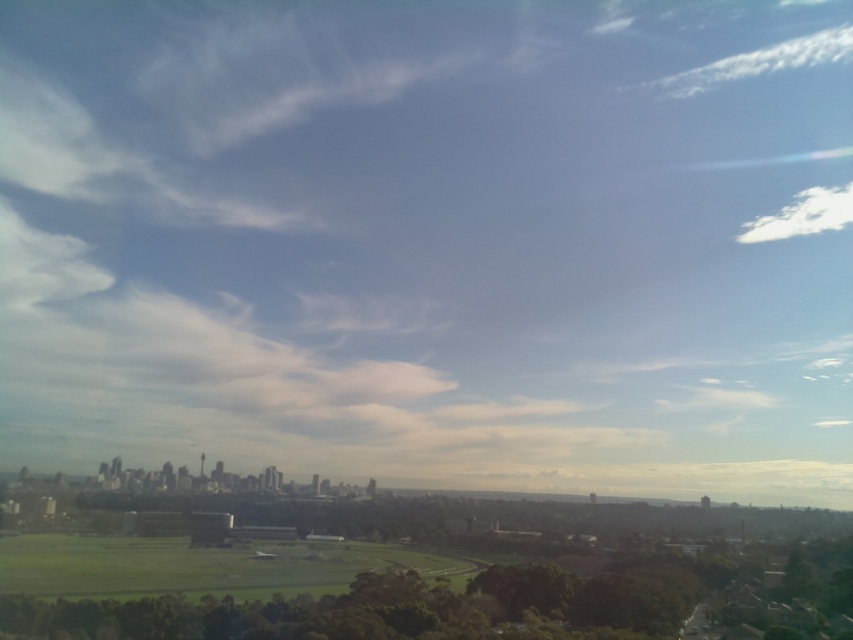
You are standing in the city park and see the green leafy tree at lower center. If you walk directly towards the point marked by coordinates (490, 604), will you be walking towards the tree?

Yes, because the green leafy tree at lower center is represented by the point (490, 604), so walking towards those coordinates will lead you directly to the tree.

You are standing in the city park and see the green leafy tree at lower center and the white fluffy cloud at upper right. Which object is closer to the ground?

The green leafy tree at lower center is closer to the ground because it is positioned under the white fluffy cloud at upper right.